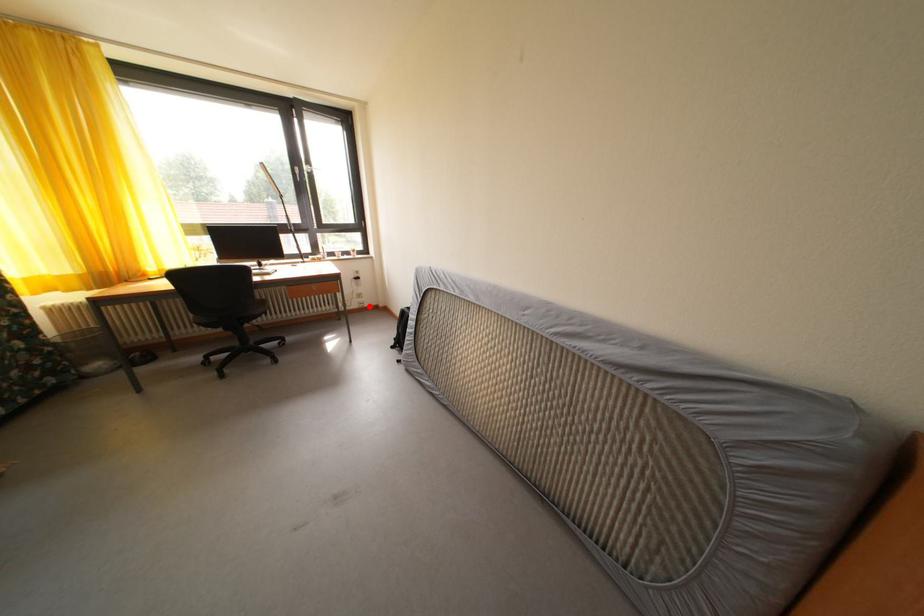
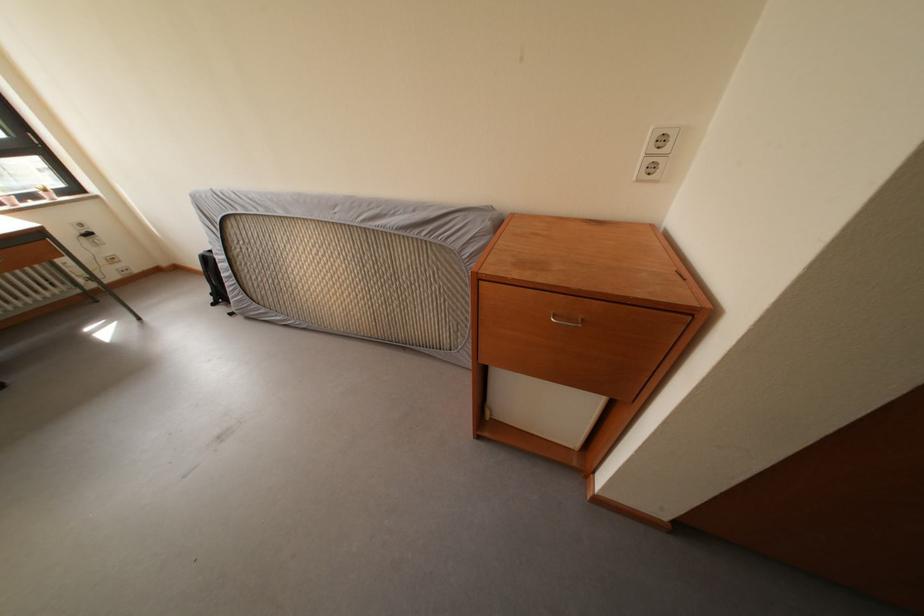
Question: I am providing you with two images of the same scene from different viewpoints. In image1, a red point is highlighted. Considering the same 3D point in image2, which of the following is correct?

Choices:
 (A) It is closer
 (B) It is farther

Answer: (B)